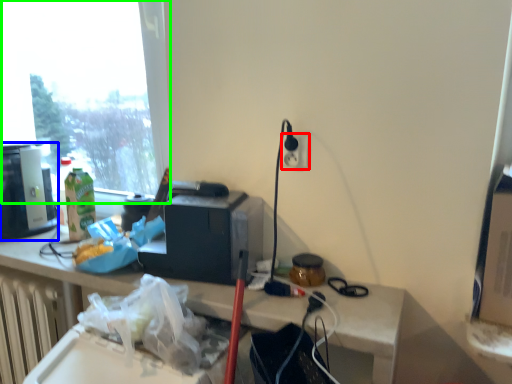
Question: Which object is positioned closest to electric outlet (highlighted by a red box)? Select from coffee machine (highlighted by a blue box) and window (highlighted by a green box).

Choices:
 (A) coffee machine
 (B) window

Answer: (A)